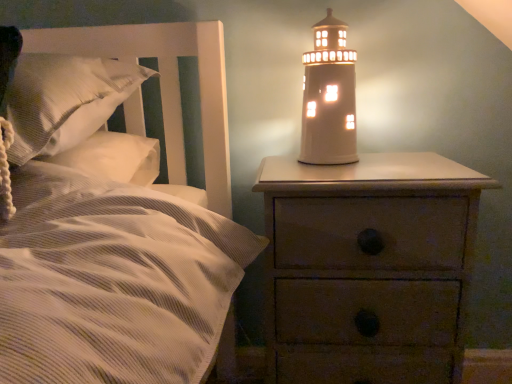
Question: From the image's perspective, is white textured pillow at left located beneath white ceramic lighthouse at upper right?

Choices:
 (A) no
 (B) yes

Answer: (B)

Question: Can you confirm if white textured pillow at left is bigger than white ceramic lighthouse at upper right?

Choices:
 (A) no
 (B) yes

Answer: (B)

Question: Is white textured pillow at left located outside white ceramic lighthouse at upper right?

Choices:
 (A) no
 (B) yes

Answer: (B)

Question: Is white textured pillow at left looking in the opposite direction of white ceramic lighthouse at upper right?

Choices:
 (A) no
 (B) yes

Answer: (B)

Question: Does white textured pillow at left have a smaller size compared to white ceramic lighthouse at upper right?

Choices:
 (A) no
 (B) yes

Answer: (A)

Question: Relative to wooden nightstand at right, is white textured pillow at left in front or behind?

Choices:
 (A) behind
 (B) front

Answer: (B)

Question: Based on their positions, is white textured pillow at left located to the left or right of wooden nightstand at right?

Choices:
 (A) left
 (B) right

Answer: (A)

Question: From the image's perspective, relative to wooden nightstand at right, is white textured pillow at left above or below?

Choices:
 (A) above
 (B) below

Answer: (A)

Question: Considering the positions of point (55, 125) and point (439, 158), is point (55, 125) closer or farther from the camera than point (439, 158)?

Choices:
 (A) closer
 (B) farther

Answer: (A)

Question: From their relative heights in the image, would you say white ceramic lighthouse at upper right is taller or shorter than wooden nightstand at right?

Choices:
 (A) short
 (B) tall

Answer: (A)

Question: Visually, is white ceramic lighthouse at upper right positioned to the left or to the right of wooden nightstand at right?

Choices:
 (A) right
 (B) left

Answer: (B)

Question: Which is correct: white ceramic lighthouse at upper right is inside wooden nightstand at right, or outside of it?

Choices:
 (A) inside
 (B) outside

Answer: (B)

Question: From a real-world perspective, is white ceramic lighthouse at upper right physically located above or below wooden nightstand at right?

Choices:
 (A) above
 (B) below

Answer: (A)

Question: Is wooden nightstand at right taller or shorter than white ceramic lighthouse at upper right?

Choices:
 (A) tall
 (B) short

Answer: (A)

Question: Is wooden nightstand at right spatially inside white ceramic lighthouse at upper right, or outside of it?

Choices:
 (A) inside
 (B) outside

Answer: (B)